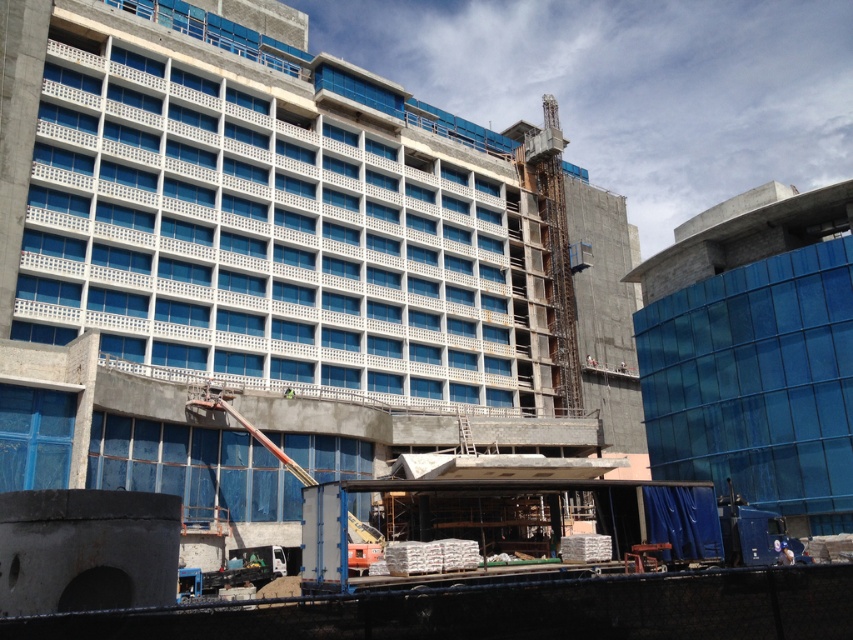
You are a construction worker standing at the base of the building. You notice two points marked on the construction site. The first point is at coordinates point (242, 280) and the second is at point (776, 358). Which point is closer to your current position?

Point (242, 280) is further to the camera than point (776, 358). Therefore, the point closer to your current position is point (776, 358).

You are a construction worker who needs to move a heavy equipment from the concrete building at center to the transparent glass building at right. Which direction should you move the equipment to reach the destination?

The concrete building at center is positioned on the left side of the transparent glass building at right, so you should move the equipment to the right to reach the destination.

You are an architect visiting a construction site. You notice the concrete building at center and the transparent glass building at right. Which one is taller?

The concrete building at center is taller than the transparent glass building at right.